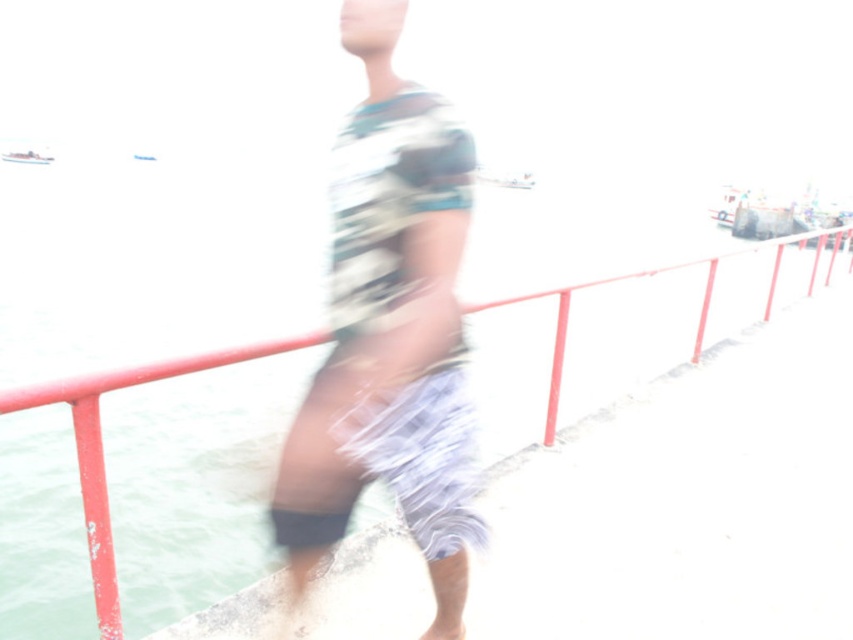
Measure the distance between camouflage fabric shirt at center and camera.

camouflage fabric shirt at center is 1.65 meters from camera.

Can you confirm if camouflage fabric shirt at center is taller than red metal railing at center?

Incorrect, camouflage fabric shirt at center's height is not larger of red metal railing at center's.

Locate an element on the screen. camouflage fabric shirt at center is located at coordinates (390, 332).

Does camouflage fabric shirt at center have a lesser width compared to white plastic boat at left?

Yes, camouflage fabric shirt at center is thinner than white plastic boat at left.

Measure the distance between camouflage fabric shirt at center and camera.

camouflage fabric shirt at center and camera are 5.42 feet apart.

The width and height of the screenshot is (853, 640). What are the coordinates of `camouflage fabric shirt at center` in the screenshot? It's located at (390, 332).

Which is in front, point (282, 410) or point (16, 157)?

Point (282, 410)

Is red metal railing at center to the left of white plastic boat at left from the viewer's perspective?

In fact, red metal railing at center is to the right of white plastic boat at left.

Identify the location of red metal railing at center. The height and width of the screenshot is (640, 853). (619, 332).

Where is `red metal railing at center`? red metal railing at center is located at coordinates (619, 332).